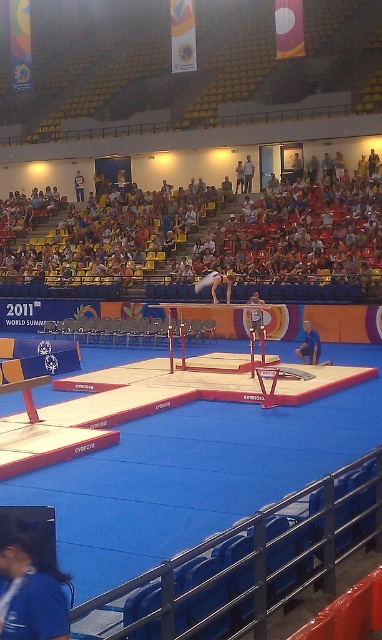
Based on the scene, where are the multicolored fabric seats at upper center located in terms of their 2D coordinates?

The multicolored fabric seats at upper center are located at the 2D coordinates of point (215,230).

You are standing in the arena watching the gymnastics competition. There is a point marked at coordinates point (56, 621). If you want to throw a small object to that point, will it land within 10 feet of where you are standing?

The point (56, 621) is 10.27 feet from viewer. Since the distance is slightly over 10 feet, the object will land just beyond 10 feet away from your current position.

You are a stage designer setting up for a gymnastics performance. You have a blue fabric at lower left and metallic red parallel bars at center. Which object is narrower?

The blue fabric at lower left has a lesser width compared to metallic red parallel bars at center, so the blue fabric at lower left is narrower.